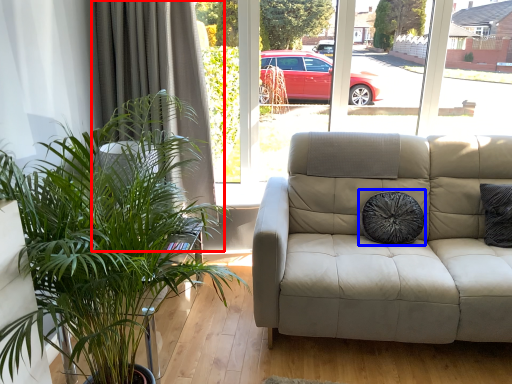
Question: Which object appears farthest to the camera in this image, curtain (highlighted by a red box) or pillow (highlighted by a blue box)?

Choices:
 (A) curtain
 (B) pillow

Answer: (A)